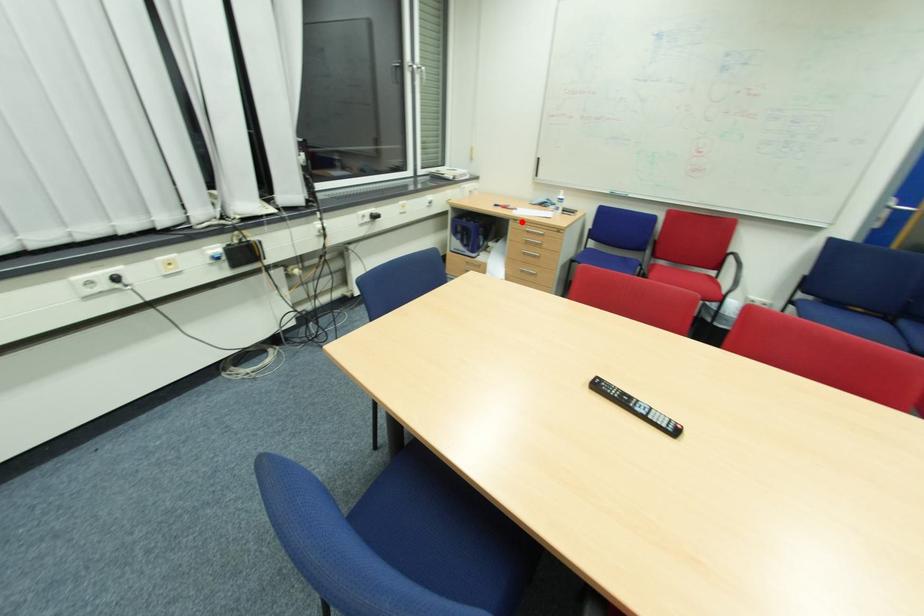
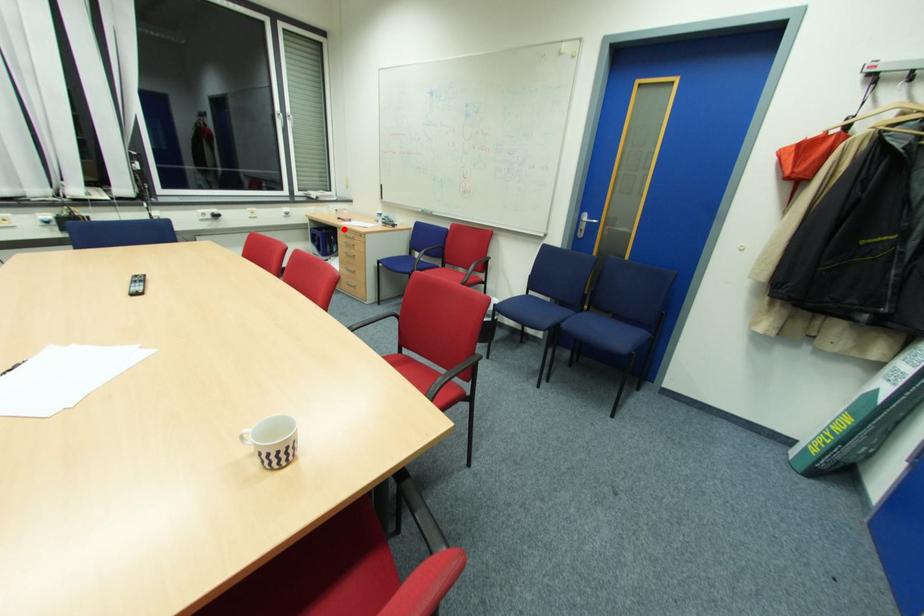
I am providing you with two images of the same scene from different viewpoints. A red point is marked on the first image and another point is marked on the second image. Does the point marked in image1 correspond to the same location as the one in image2?

Yes